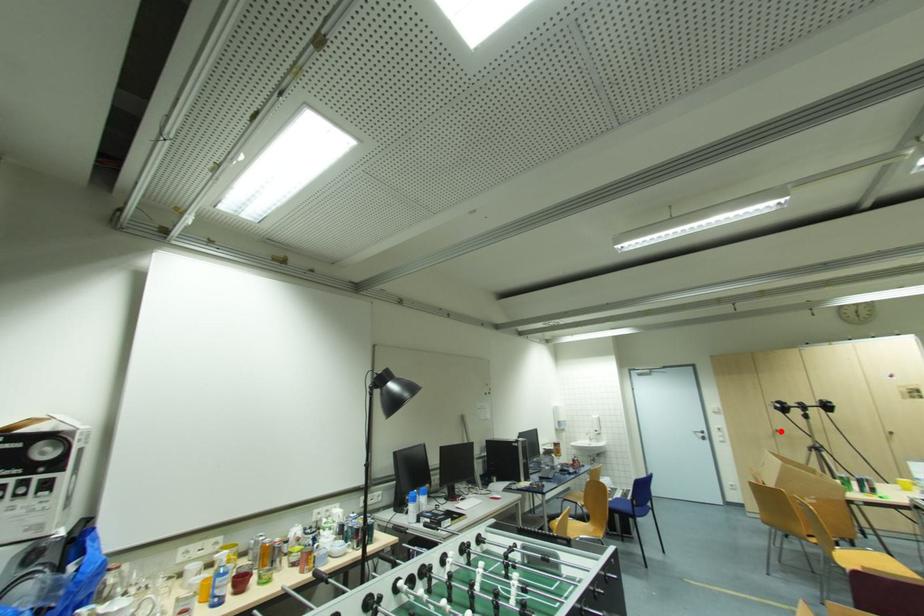
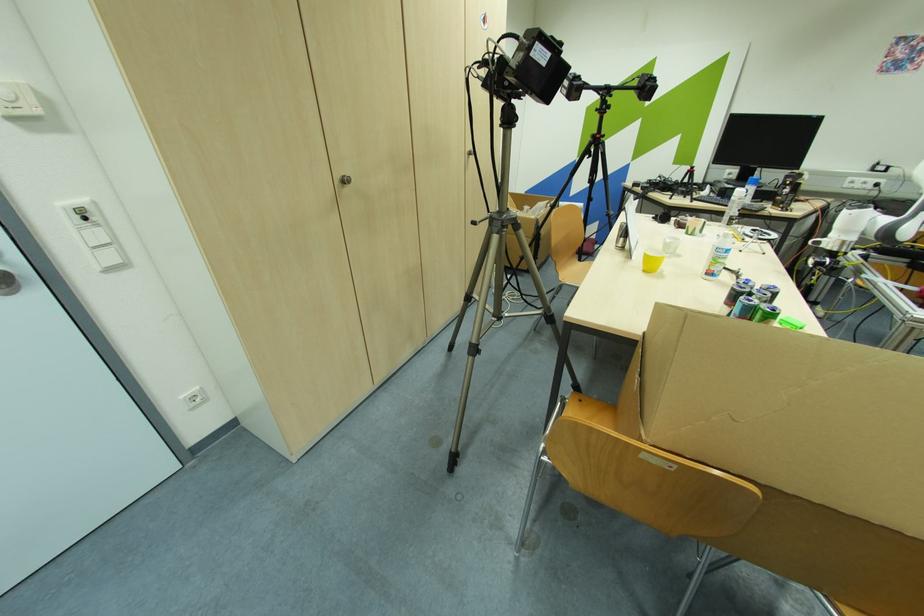
Find the pixel in the second image that matches the highlighted location in the first image.

(348, 182)